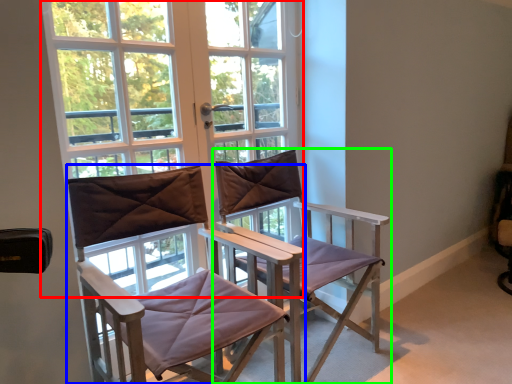
Question: Considering the real-world distances, which object is farthest from window (highlighted by a red box)? chair (highlighted by a blue box) or chair (highlighted by a green box)?

Choices:
 (A) chair
 (B) chair

Answer: (B)